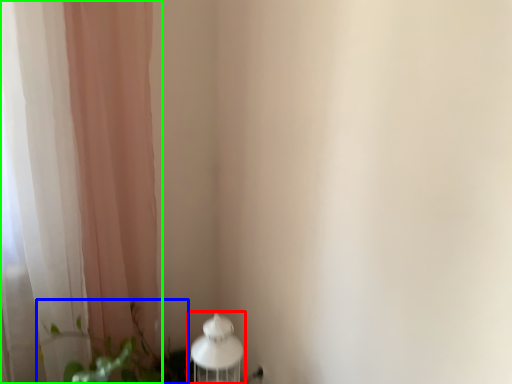
Question: Which object is the farthest from table lamp (highlighted by a red box)? Choose among these: plant (highlighted by a blue box) or curtain (highlighted by a green box).

Choices:
 (A) plant
 (B) curtain

Answer: (B)